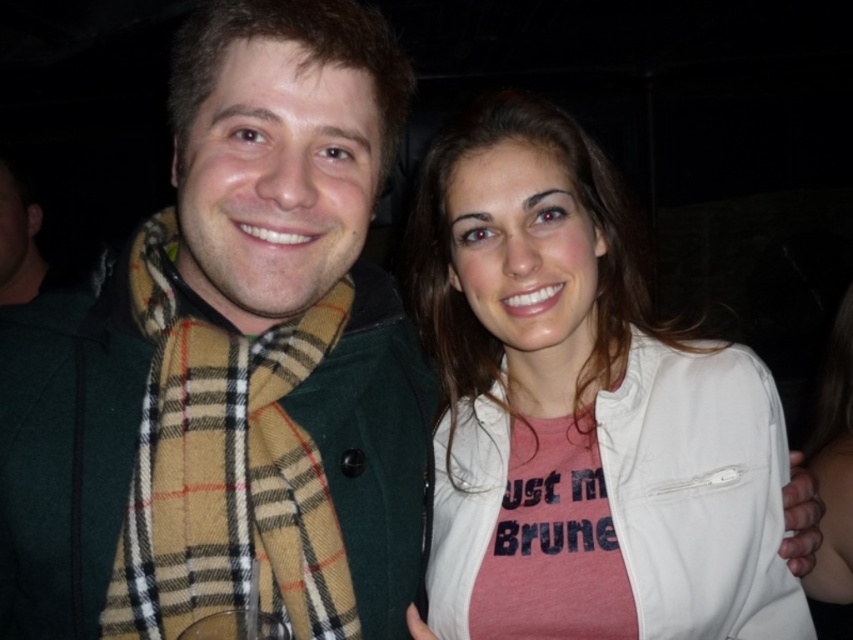
Question: Is green wool scarf at center above white matte jacket at upper right?

Choices:
 (A) yes
 (B) no

Answer: (A)

Question: Which of the following is the closest to the observer?

Choices:
 (A) white matte jacket at upper right
 (B) smooth white shirt at center

Answer: (A)

Question: Is green wool scarf at center bigger than smooth white shirt at center?

Choices:
 (A) no
 (B) yes

Answer: (A)

Question: Which point is closer to the camera?

Choices:
 (A) (386, 342)
 (B) (827, 584)

Answer: (A)

Question: Does green wool scarf at center come behind white matte jacket at upper right?

Choices:
 (A) no
 (B) yes

Answer: (A)

Question: Among these objects, which one is nearest to the camera?

Choices:
 (A) white matte jacket at upper right
 (B) green wool scarf at center

Answer: (B)